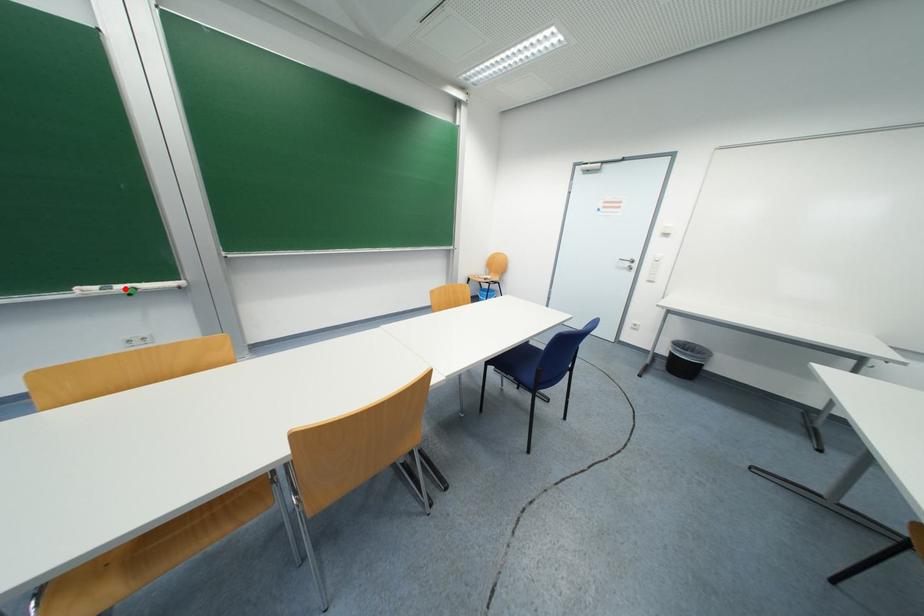
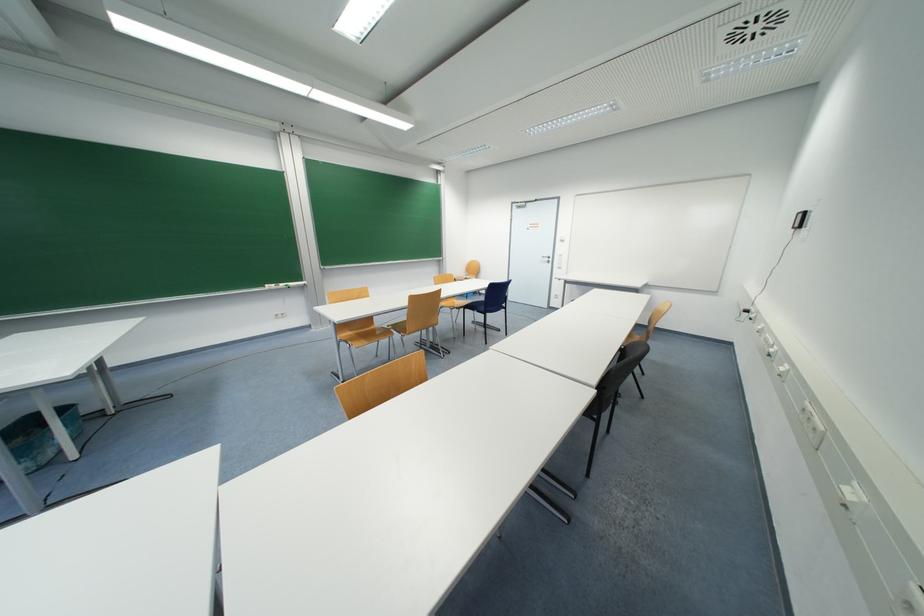
Question: A red point is marked in image1. In image2, is the corresponding 3D point closer to the camera or farther? Reply with the corresponding letter.

Choices:
 (A) The corresponding 3D point is closer.
 (B) The corresponding 3D point is farther.

Answer: (A)